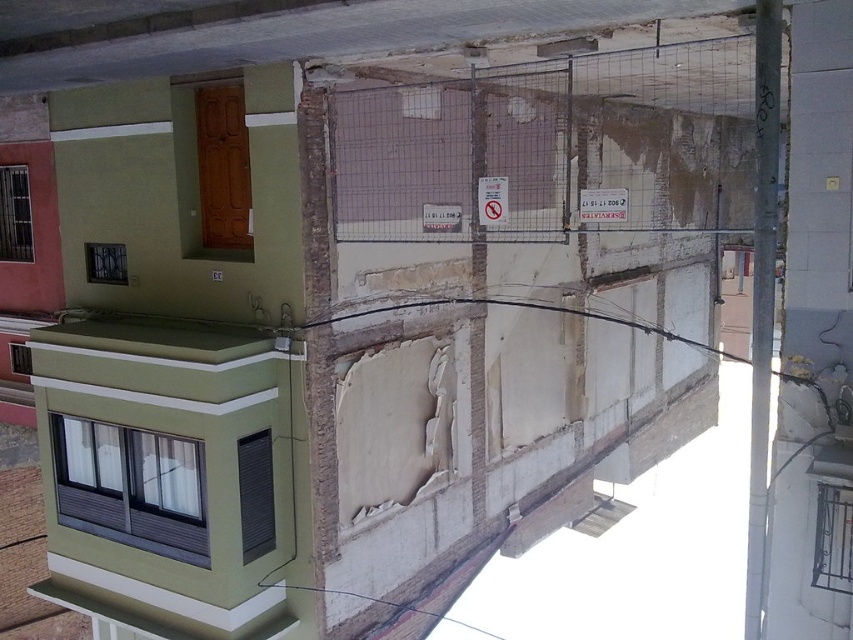
Is white paper sign at center to the left of white plastic sign at center from the viewer's perspective?

Incorrect, white paper sign at center is not on the left side of white plastic sign at center.

Does white paper sign at center come in front of white plastic sign at center?

Yes, white paper sign at center is in front of white plastic sign at center.

This screenshot has width=853, height=640. What do you see at coordinates (602, 204) in the screenshot?
I see `white paper sign at center` at bounding box center [602, 204].

Find the location of `white paper sign at center`. white paper sign at center is located at coordinates (602, 204).